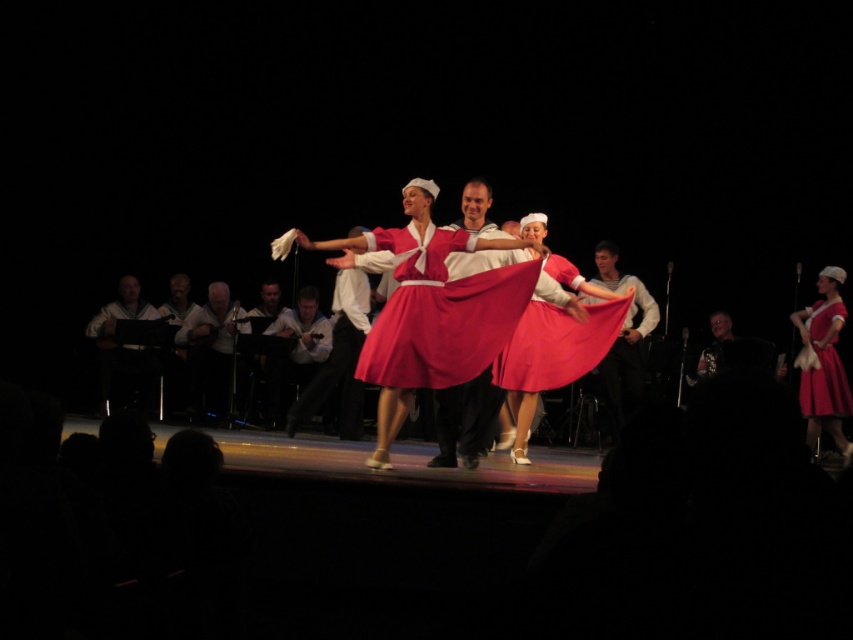
Does smooth gray sweater at left have a smaller size compared to white leather jacket at left?

Incorrect, smooth gray sweater at left is not smaller in size than white leather jacket at left.

Can you confirm if smooth gray sweater at left is wider than white leather jacket at left?

Indeed, smooth gray sweater at left has a greater width compared to white leather jacket at left.

Which is behind, point (218, 380) or point (138, 404)?

Positioned behind is point (218, 380).

Where is `smooth gray sweater at left`? This screenshot has width=853, height=640. smooth gray sweater at left is located at coordinates (210, 349).

Is matte pink skirt at center below smooth gray sweater at left?

No.

Does point (521, 385) come behind point (193, 413)?

No.

Measure the distance between matte pink skirt at center and camera.

matte pink skirt at center and camera are 6.60 meters apart.

This screenshot has height=640, width=853. I want to click on matte pink skirt at center, so click(x=556, y=344).

Is matte red skirt at center smaller than smooth gray sweater at left?

Actually, matte red skirt at center might be larger than smooth gray sweater at left.

Does matte red skirt at center appear over smooth gray sweater at left?

Correct, matte red skirt at center is located above smooth gray sweater at left.

This screenshot has width=853, height=640. What do you see at coordinates (428, 312) in the screenshot? I see `matte red skirt at center` at bounding box center [428, 312].

The height and width of the screenshot is (640, 853). In order to click on matte red skirt at center in this screenshot , I will do `click(428, 312)`.